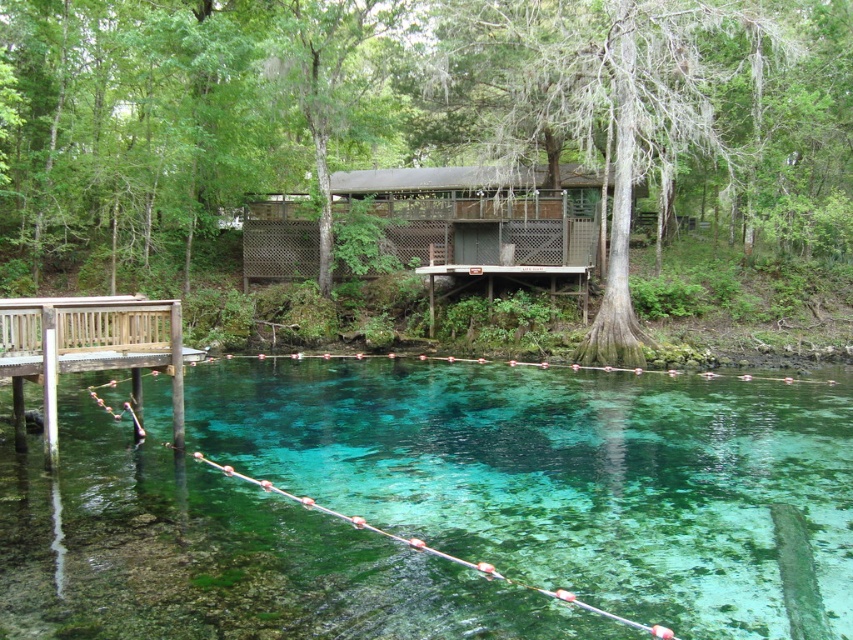
Question: Is green mossy tree at center closer to camera compared to wooden dock at left?

Choices:
 (A) no
 (B) yes

Answer: (A)

Question: Considering the real-world distances, which object is farthest from the wooden dock at left?

Choices:
 (A) gray mossy tree at center
 (B) wooden dock at center

Answer: (A)

Question: Where is clear glassy water at center located in relation to wooden dock at center in the image?

Choices:
 (A) left
 (B) right

Answer: (A)

Question: Which point appears closest to the camera in this image?

Choices:
 (A) (485, 237)
 (B) (352, 102)
 (C) (581, 272)

Answer: (C)

Question: Is green mossy tree at center below wooden dock at left?

Choices:
 (A) yes
 (B) no

Answer: (B)

Question: Which object is farther from the camera taking this photo?

Choices:
 (A) green mossy tree at center
 (B) gray mossy tree at center

Answer: (B)